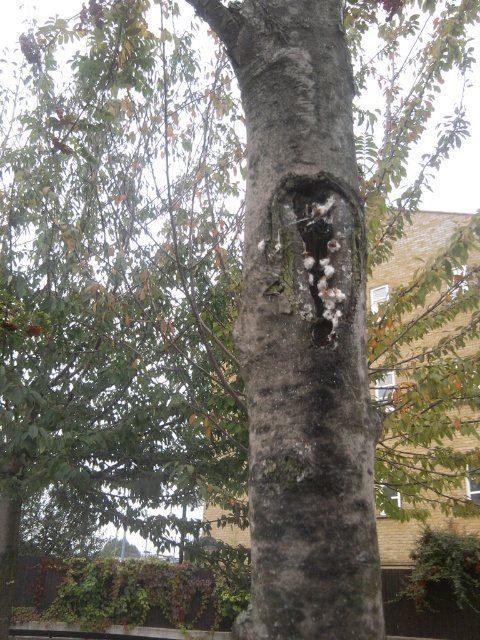
You are a bird looking for a nesting spot. You see the gray rough bark tree trunk at center and the white fibrous hole at center. Which object is closer to the left side of the tree trunk?

The gray rough bark tree trunk at center is to the left of the white fibrous hole at center, so the gray rough bark tree trunk at center is closer to the left side of the tree trunk.

You are a bird looking for a nesting spot. You see the gray rough bark tree trunk at center and the white fibrous hole at center. Which object is closer to the ground?

The white fibrous hole at center is closer to the ground because the gray rough bark tree trunk at center is positioned over it.

You are a bird looking for a nesting spot. You see the gray rough bark tree trunk at center and the white fibrous hole at center. Which one is nearer to you?

The gray rough bark tree trunk at center is closer to you than the white fibrous hole at center.